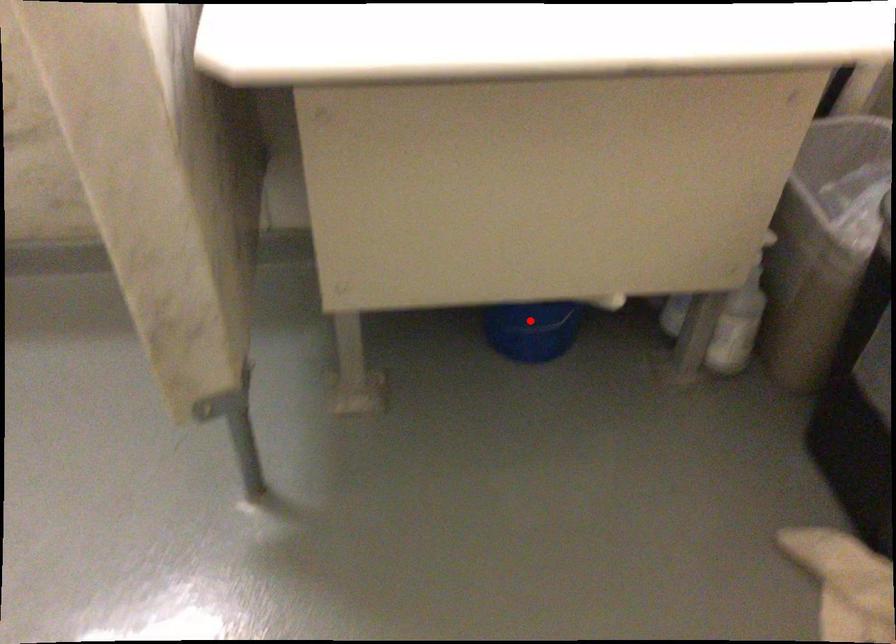
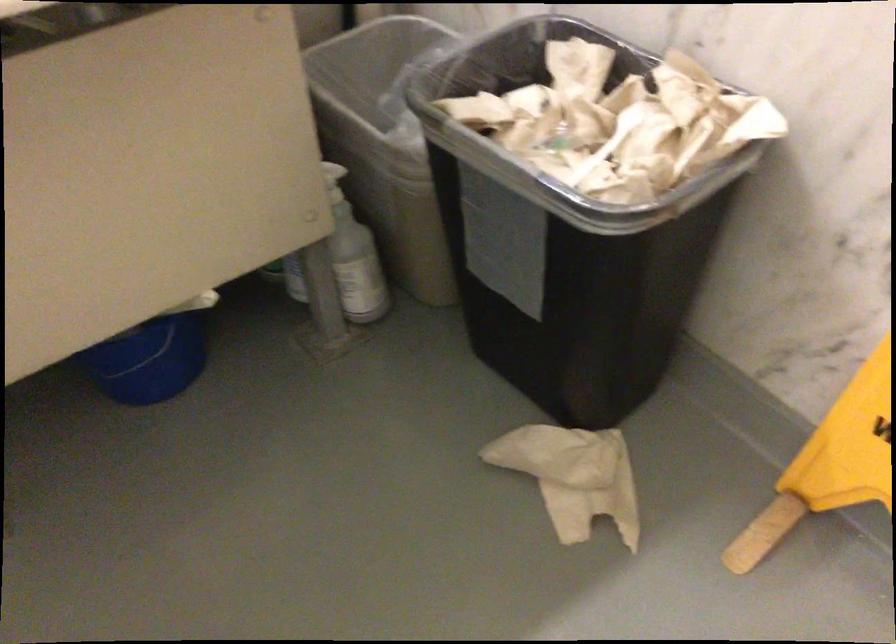
Question: A red point is marked in image1. In image2, is the corresponding 3D point closer to the camera or farther? Reply with the corresponding letter.

Choices:
 (A) The corresponding 3D point is closer.
 (B) The corresponding 3D point is farther.

Answer: (A)